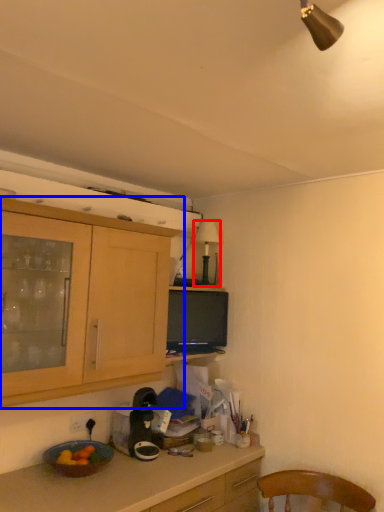
Question: Which object appears closest to the camera in this image, lamp (highlighted by a red box) or cabinetry (highlighted by a blue box)?

Choices:
 (A) lamp
 (B) cabinetry

Answer: (B)